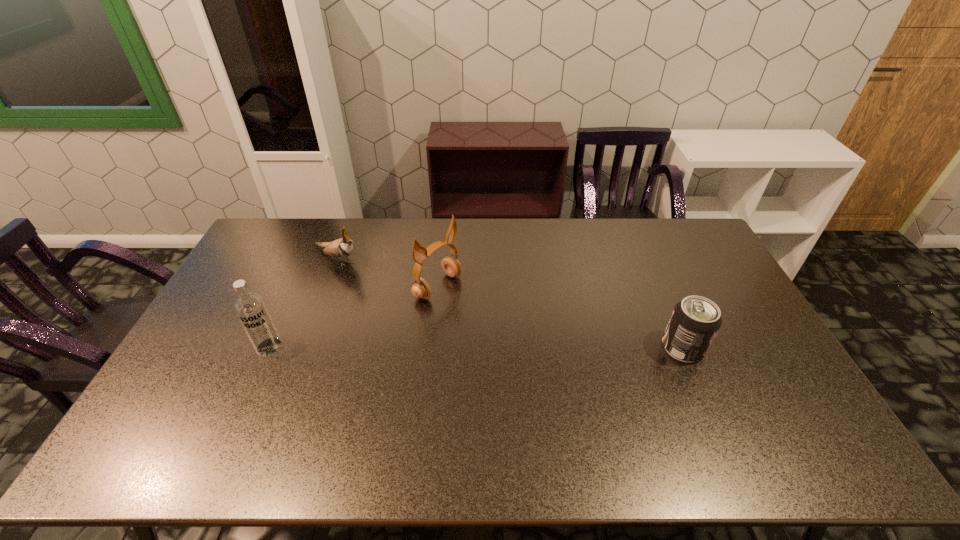
Identify the location of free space located 0.300m on the front-facing side of the second object from right to left. The width and height of the screenshot is (960, 540). (529, 345).

The width and height of the screenshot is (960, 540). In order to click on free space located on the front-facing side of the second object from right to left in this screenshot , I will do `click(554, 361)`.

You are a GUI agent. You are given a task and a screenshot of the screen. Output one action in this format:
    pyautogui.click(x=<x>, y=<y>)
    Task: Click on the object that is at the far edge
    This screenshot has height=540, width=960.
    Given the screenshot: What is the action you would take?
    pyautogui.click(x=341, y=248)

In the image, there is a desktop. At what (x,y) coordinates should I click in order to perform the action: click on vacant space at the far edge. Please return your answer as a coordinate pair (x, y). The height and width of the screenshot is (540, 960). Looking at the image, I should click on (646, 247).

Identify the location of free location at the near edge of the desktop. The width and height of the screenshot is (960, 540). (642, 415).

The width and height of the screenshot is (960, 540). I want to click on vacant space at the left edge of the desktop, so (x=204, y=333).

The width and height of the screenshot is (960, 540). Find the location of `vacant space at the right edge of the desktop`. vacant space at the right edge of the desktop is located at coordinates (705, 284).

In the image, there is a desktop. Where is `vacant space at the far left corner`? vacant space at the far left corner is located at coordinates click(x=296, y=226).

The image size is (960, 540). In order to click on vacant space at the far right corner of the desktop in this screenshot , I will do `click(673, 224)`.

Identify the location of vacant area that lies between the second object from right to left and the vodka. (x=353, y=316).